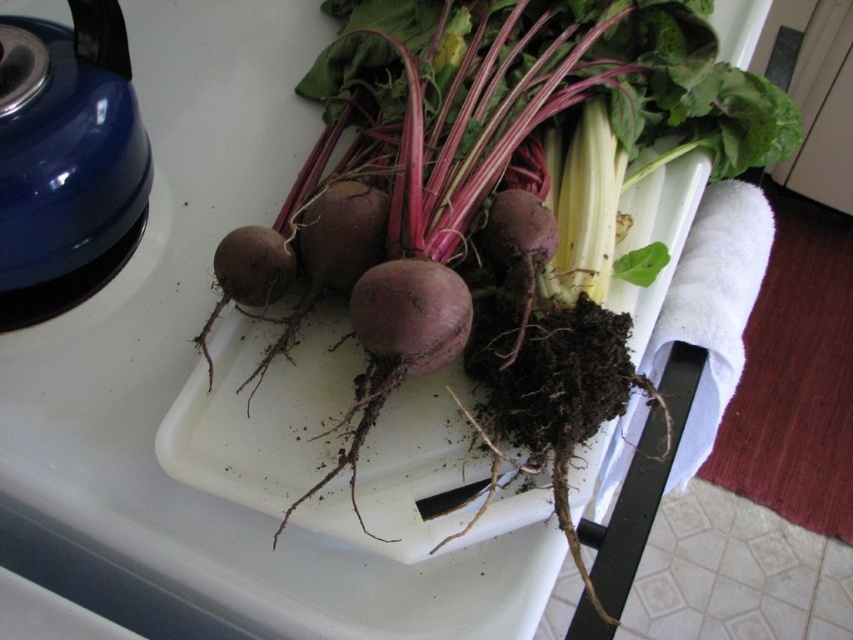
You are preparing to cook and need to access the blue glossy kettle at upper left. Is the purple matte beetroot at center blocking your direct path to it?

The purple matte beetroot at center is in front of the blue glossy kettle at upper left, so it is blocking the direct path to the kettle.

You are a chef preparing ingredients for a beetroot salad. You need to place the purple matte beetroot at center closer to the blue glossy kettle at upper left. How much distance do you need to move it?

The purple matte beetroot at center is currently 36.15 centimeters away from the blue glossy kettle at upper left. To move it closer, you would need to reduce this distance by sliding it towards the kettle.

You are a chef preparing ingredients on the kitchen counter. You need to move the blue glossy kettle at upper left to another location. Can you lift the purple matte beetroot at center to access it?

The purple matte beetroot at center is positioned over blue glossy kettle at upper left, so you cannot access the blue glossy kettle at upper left without moving the beetroot first.